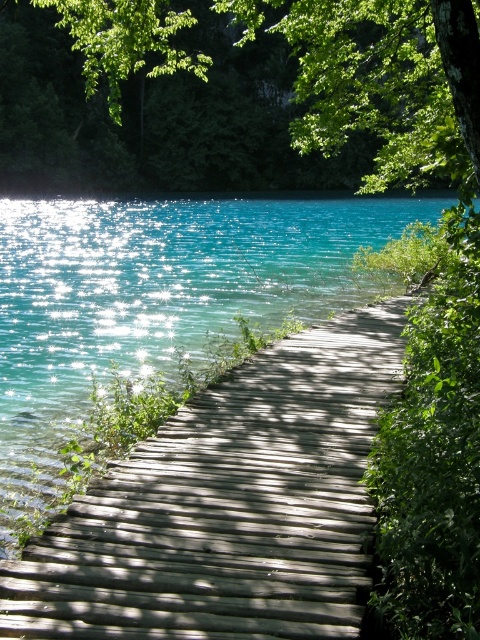
Does wooden dock at center appear on the left side of green leafy tree at upper center?

Yes, wooden dock at center is to the left of green leafy tree at upper center.

Consider the image. Between wooden dock at center and green leafy tree at upper center, which one appears on the right side from the viewer's perspective?

From the viewer's perspective, green leafy tree at upper center appears more on the right side.

Is point (275, 392) less distant than point (360, 80)?

Yes, it is in front of point (360, 80).

Where is `wooden dock at center`? wooden dock at center is located at coordinates (228, 506).